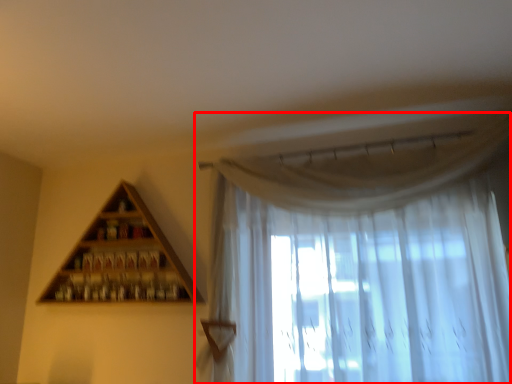
Question: From the image's perspective, what is the correct spatial relationship of curtain (annotated by the red box) in relation to shelf?

Choices:
 (A) above
 (B) below

Answer: (A)